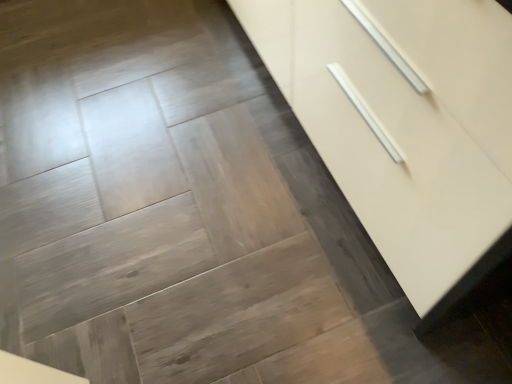
Question: Should I look upward or downward to see white glossy cabinet at center?

Choices:
 (A) up
 (B) down

Answer: (A)